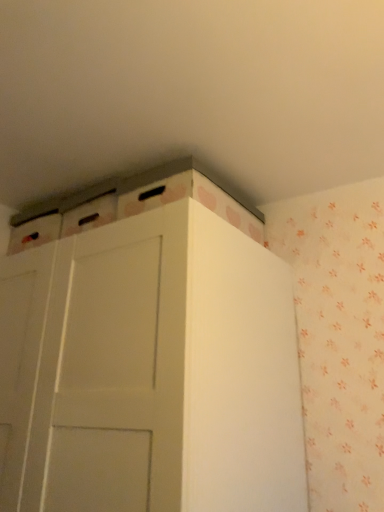
What is the approximate width of white matte cabinet at upper center?

It is 25.99 inches.

What is the approximate height of white matte cabinet at upper center?

The height of white matte cabinet at upper center is 34.35 inches.

Find the location of a particular element. The height and width of the screenshot is (512, 384). white matte cabinet at upper center is located at coordinates (161, 370).

What do you see at coordinates (161, 370) in the screenshot?
I see `white matte cabinet at upper center` at bounding box center [161, 370].

Identify the location of white matte cabinet at upper center. (161, 370).